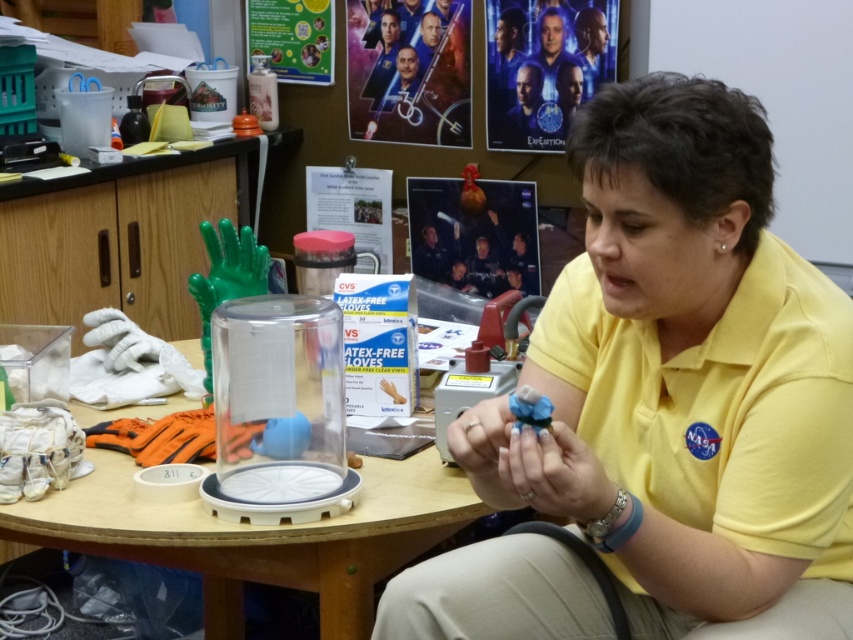
Question: Which point is farther to the camera?

Choices:
 (A) clear plastic table at center
 (B) blue matte object at center

Answer: (A)

Question: Which of the following is the closest to the observer?

Choices:
 (A) (439, 499)
 (B) (788, 288)
 (C) (503, 477)

Answer: (C)

Question: Which of the following is the farthest from the observer?

Choices:
 (A) yellow fabric shirt at center
 (B) blue matte object at center

Answer: (A)

Question: Where is clear plastic table at center located in relation to blue matte object at center in the image?

Choices:
 (A) above
 (B) below

Answer: (B)

Question: Is yellow fabric shirt at center to the right of blue matte object at center from the viewer's perspective?

Choices:
 (A) no
 (B) yes

Answer: (B)

Question: Does yellow fabric shirt at center appear on the left side of blue matte object at center?

Choices:
 (A) no
 (B) yes

Answer: (A)